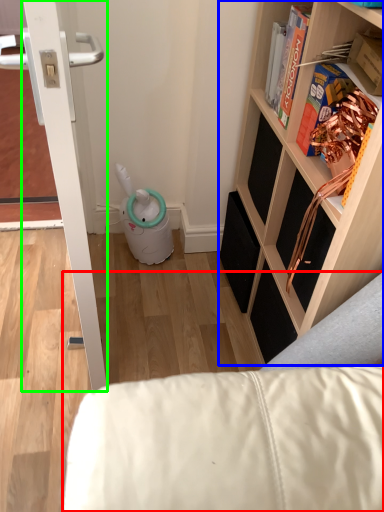
Question: Which object is the closest to the furniture (highlighted by a red box)? Choose among these: shelf (highlighted by a blue box) or door (highlighted by a green box).

Choices:
 (A) shelf
 (B) door

Answer: (A)